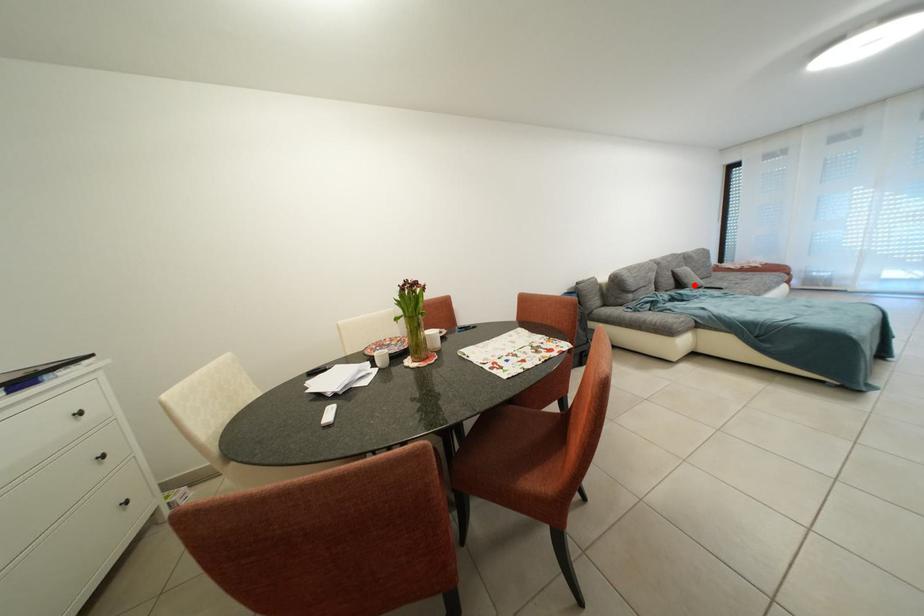
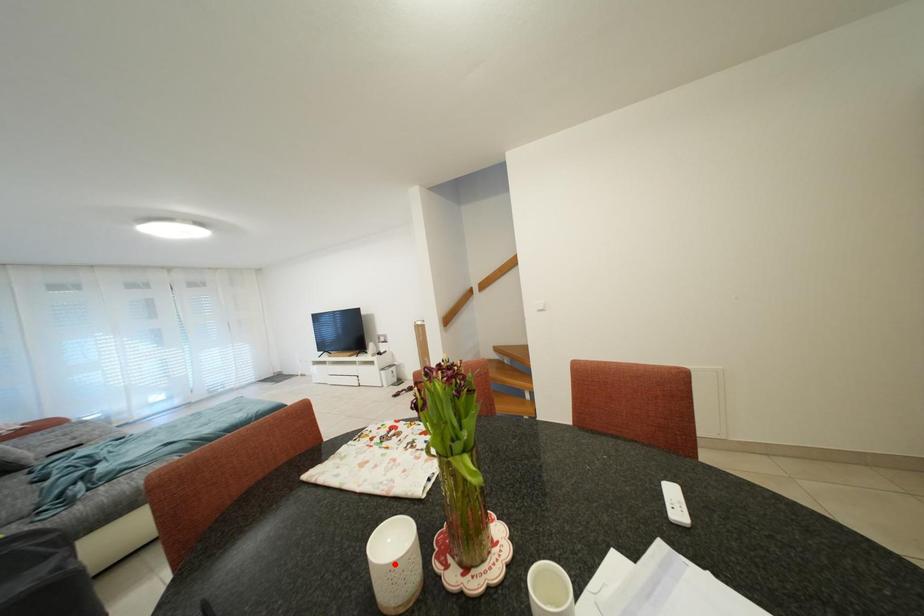
I am providing you with two images of the same scene from different viewpoints. A red point is marked on the first image and another point is marked on the second image. Is the marked point in image1 the same physical position as the marked point in image2?

No